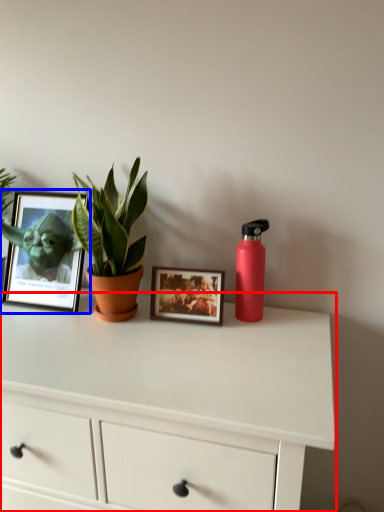
Question: Among these objects, which one is farthest to the camera, chest of drawers (highlighted by a red box) or picture frame (highlighted by a blue box)?

Choices:
 (A) chest of drawers
 (B) picture frame

Answer: (B)